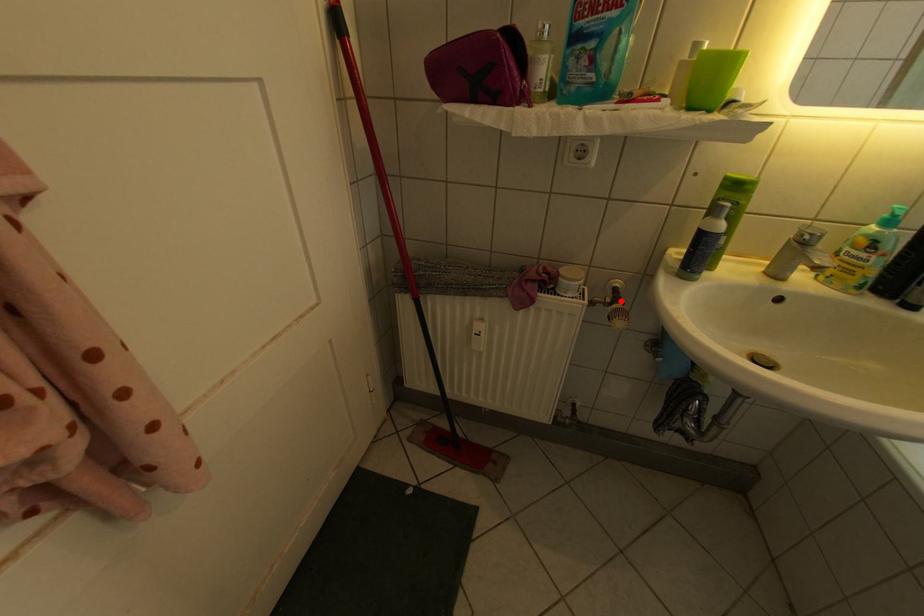
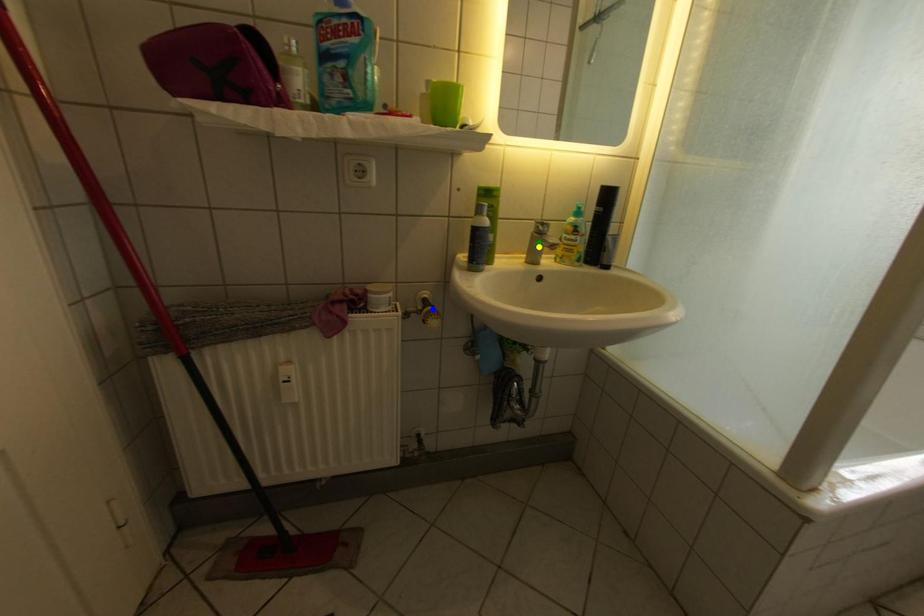
Question: I am providing you with two images of the same scene from different viewpoints. A red point is marked on the first image. You are given multiple points on the second image. Which point in image 2 represents the same 3d spot as the red point in image 1?

Choices:
 (A) green point
 (B) yellow point
 (C) blue point

Answer: (C)